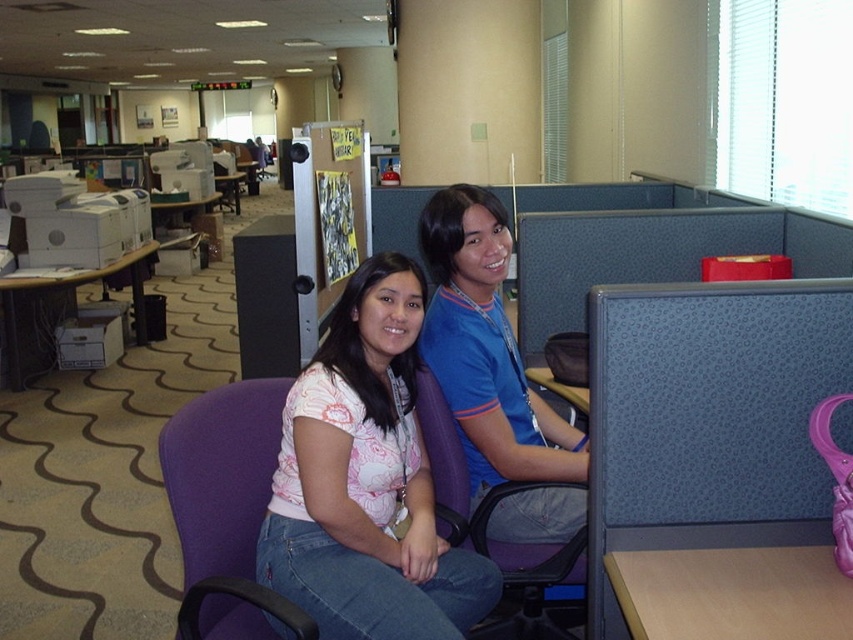
Question: Does purple fabric swivel chair at lower left appear on the right side of white plastic printer at left?

Choices:
 (A) yes
 (B) no

Answer: (A)

Question: Can you confirm if purple fabric chair at center is positioned below white plastic printer at left?

Choices:
 (A) no
 (B) yes

Answer: (B)

Question: Can you confirm if pink printed blouse at center is positioned to the right of purple fabric chair at center?

Choices:
 (A) no
 (B) yes

Answer: (A)

Question: Among these objects, which one is farthest from the camera?

Choices:
 (A) purple fabric chair at center
 (B) pink printed blouse at center

Answer: (A)

Question: Which of the following is the farthest from the observer?

Choices:
 (A) (486, 336)
 (B) (216, 493)
 (C) (335, 308)
 (D) (415, 406)

Answer: (A)

Question: Which point appears closest to the camera in this image?

Choices:
 (A) (317, 509)
 (B) (436, 445)
 (C) (190, 604)

Answer: (C)